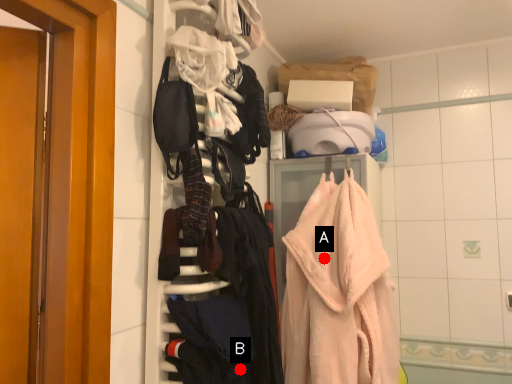
Question: Two points are circled on the image, labeled by A and B beside each circle. Among these points, which one is farthest from the camera?

Choices:
 (A) A is further
 (B) B is further

Answer: (A)